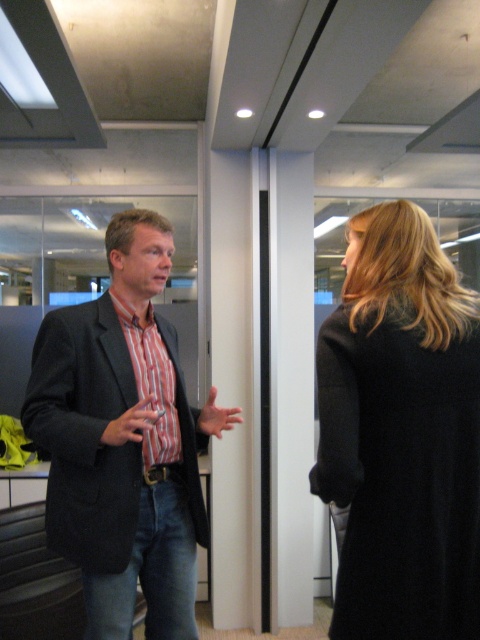
You are an interior designer observing an office scene. You need to determine the relative lengths of the black wool coat at right and the striped cotton shirt at center. Which one is longer?

The striped cotton shirt at center is longer than the black wool coat at right.

You are standing in an office and see the black wool coat at right and the striped cotton shirt at center. Which clothing item is positioned more to the right side of the scene?

The black wool coat at right is positioned to the right of the striped cotton shirt at center, so it is more to the right side of the scene.

You are a delivery person who needs to hand a package to the woman wearing the black wool coat at right. The package is 3 feet long. Can you comfortably hand the package to her without moving closer than 3 feet?

They are 3.64 feet apart, so yes, you can comfortably hand the package to the woman wearing the black wool coat at right without moving closer than 3 feet since the distance between you is sufficient.